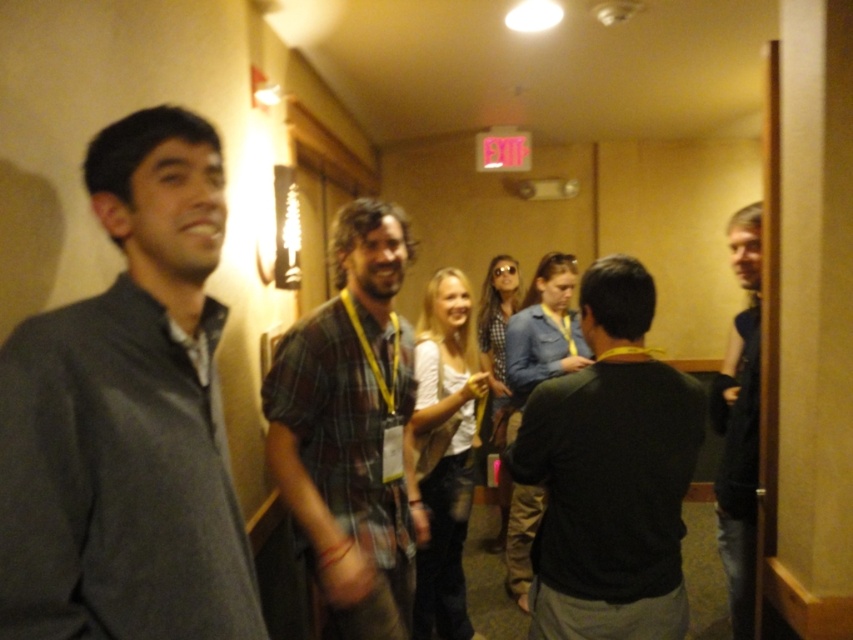
You are standing in the hallway and want to move from the point at coordinates (341, 348) to the point at coordinates (740, 323). Which direction should you move in to get closer to your destination?

You should move downward because point (740, 323) is farther from the camera compared to point (341, 348), so moving downward would take you towards the destination.

You are standing in the hallway and notice a person wearing a matte gray shirt at left. Can you determine the exact coordinates of where this person is located?

The matte gray shirt at left is located at point (128, 417).

You are a delivery robot with a package that needs to be delivered to the person wearing the dark blue sweater at right. You are currently positioned near the plaid fabric shirt at center. The robot has a maximum delivery range of 1 meter. Can you successfully deliver the package without moving?

The plaid fabric shirt at center and dark blue sweater at right are 1.05 meters apart from each other. Since the robot has a maximum delivery range of 1 meter, it cannot reach the dark blue sweater at right from the current position near the plaid fabric shirt at center.